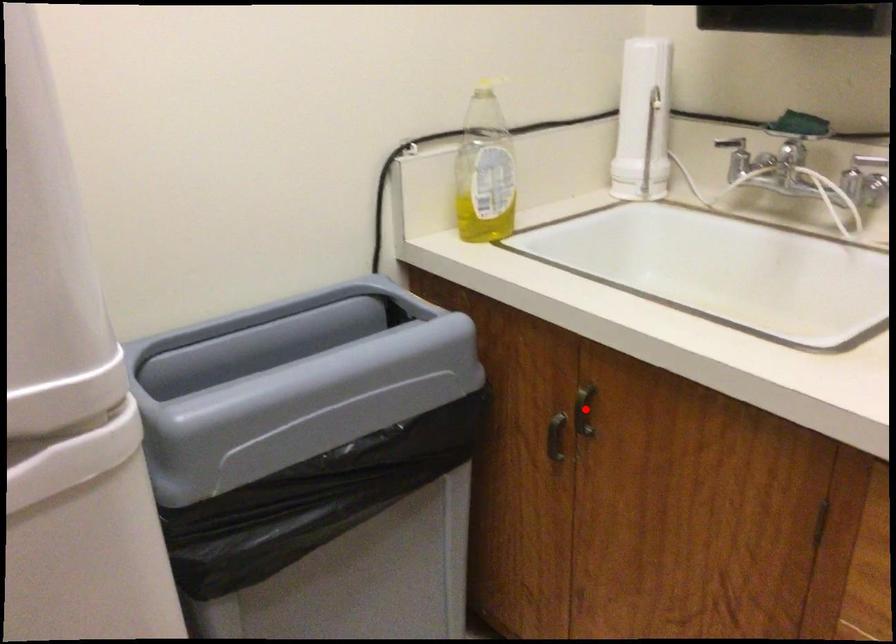
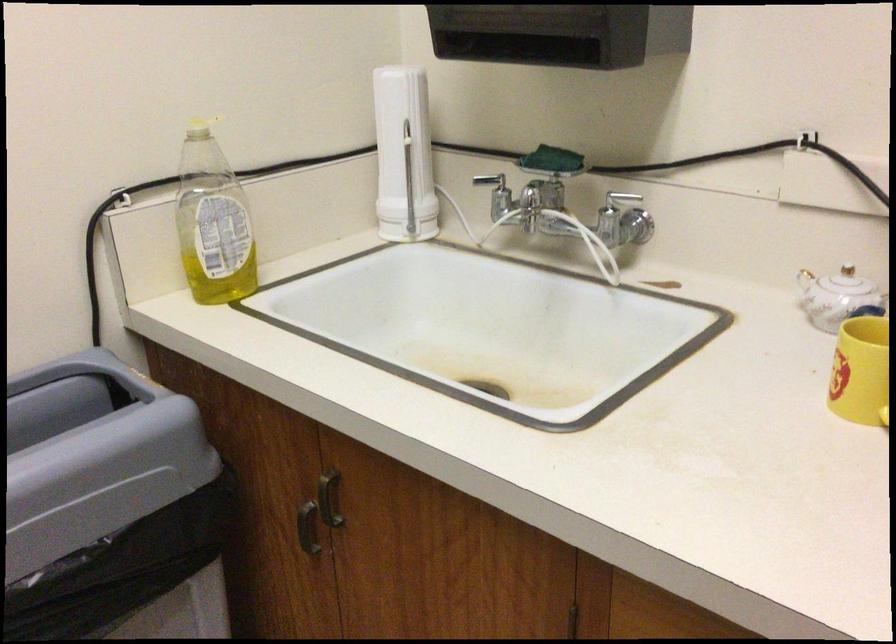
Question: I am providing you with two images of the same scene from different viewpoints. Image1 has a red point marked. In image2, the corresponding 3D location appears at what relative position? Reply with the corresponding letter.

Choices:
 (A) Closer
 (B) Farther

Answer: (A)